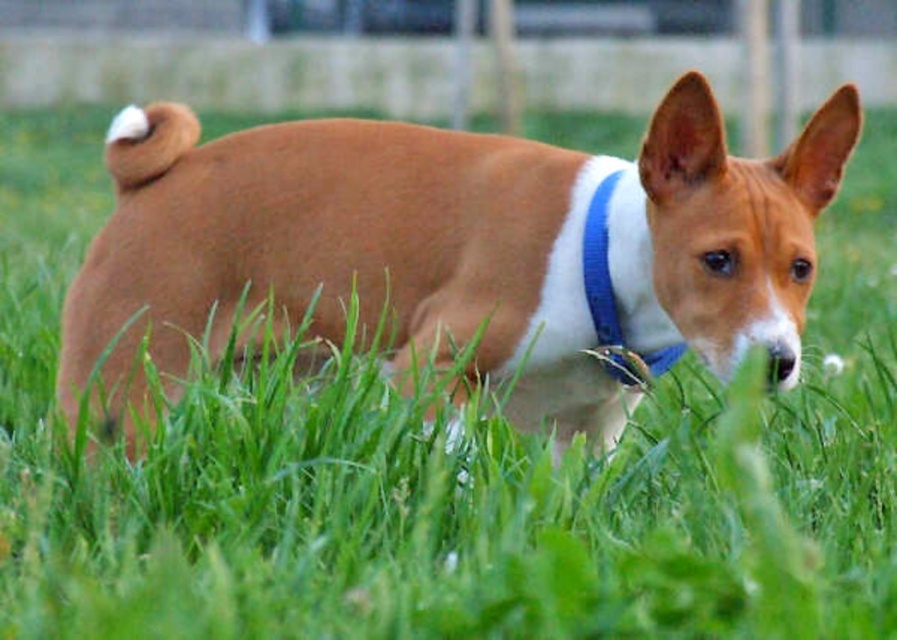
Question: Does brown smooth dog at center appear under blue fabric neckband at center?

Choices:
 (A) no
 (B) yes

Answer: (B)

Question: Which point is closer to the camera?

Choices:
 (A) blue fabric neckband at center
 (B) brown smooth dog at center

Answer: (B)

Question: In this image, where is brown smooth dog at center located relative to blue fabric neckband at center?

Choices:
 (A) right
 (B) left

Answer: (B)

Question: Does brown smooth dog at center have a smaller size compared to blue fabric neckband at center?

Choices:
 (A) no
 (B) yes

Answer: (A)